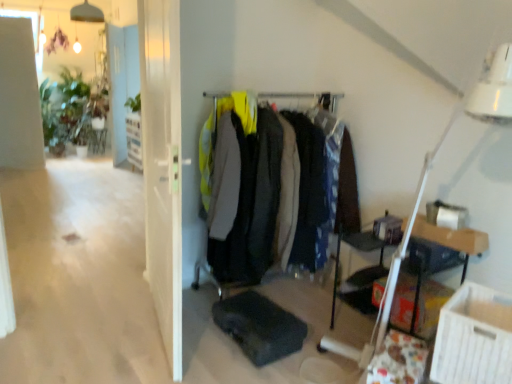
What are the coordinates of `free space to the left of white glossy shelf at upper center` in the screenshot? It's located at (115, 169).